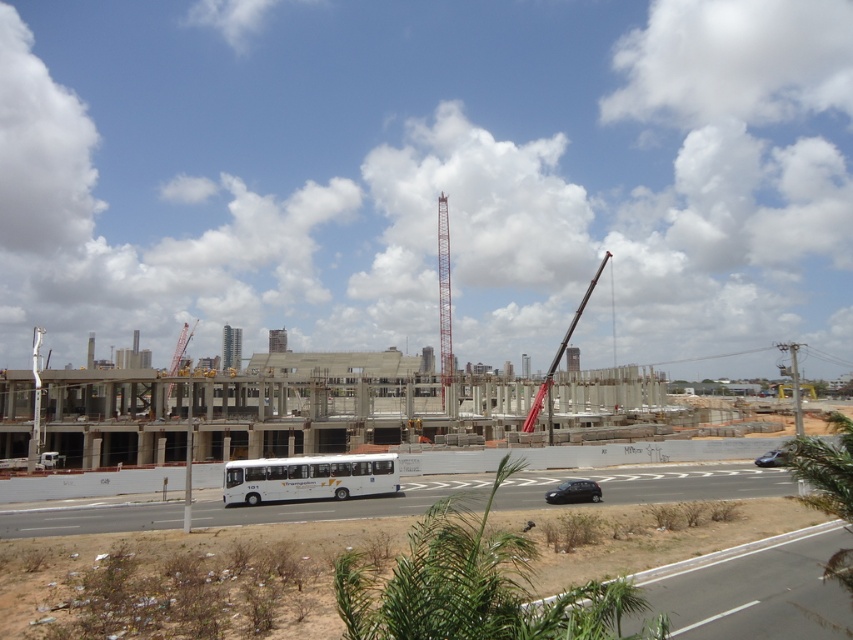
You are a delivery driver needing to pass through the construction site with your truck, which is as wide as the black matte car at lower center. Can your truck safely pass between the red metallic crane at center and the nearest obstacle without hitting anything?

The red metallic crane at center is wider than the black matte car at lower center. Since your truck is as wide as the black matte car at lower center, there might not be enough space to pass safely between the crane and the nearest obstacle. You should check the available space carefully before proceeding.

You are a delivery driver approaching the construction site and need to park your vehicle. You see the red painted metal tower crane at center and the shiny black sedan at lower right. Which object is closer to the road where you are driving?

The shiny black sedan at lower right is behind the red painted metal tower crane at center, so the red painted metal tower crane at center is closer to the road where you are driving.

You are a delivery truck driver who needs to pass through the construction site. You see the red metallic crane at center and the black matte car at lower center. What is the minimum distance you should maintain between your truck and both objects to ensure safety?

The red metallic crane at center and the black matte car at lower center are 33.98 meters apart. To ensure safety, the delivery truck driver should maintain a minimum distance of at least 33.98 meters from both objects.